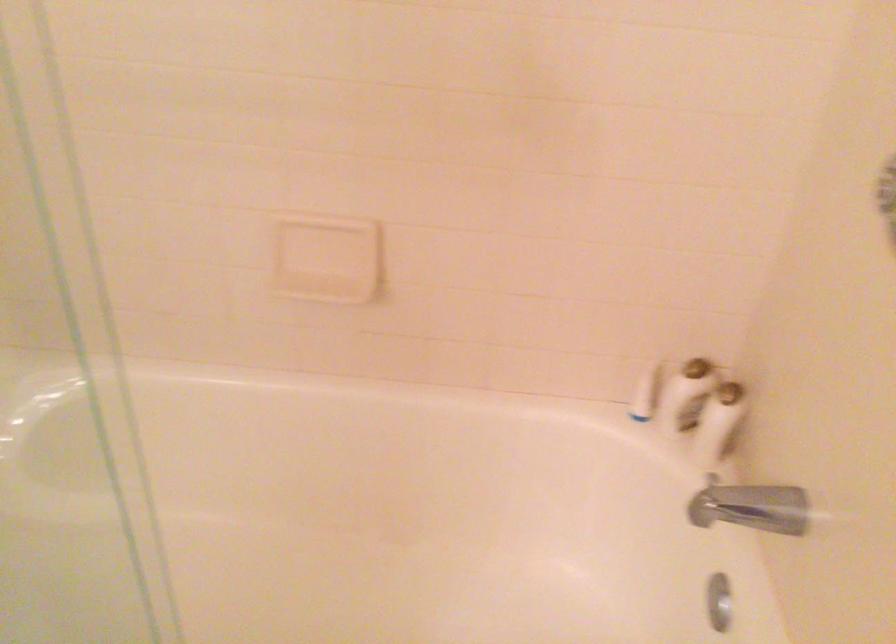
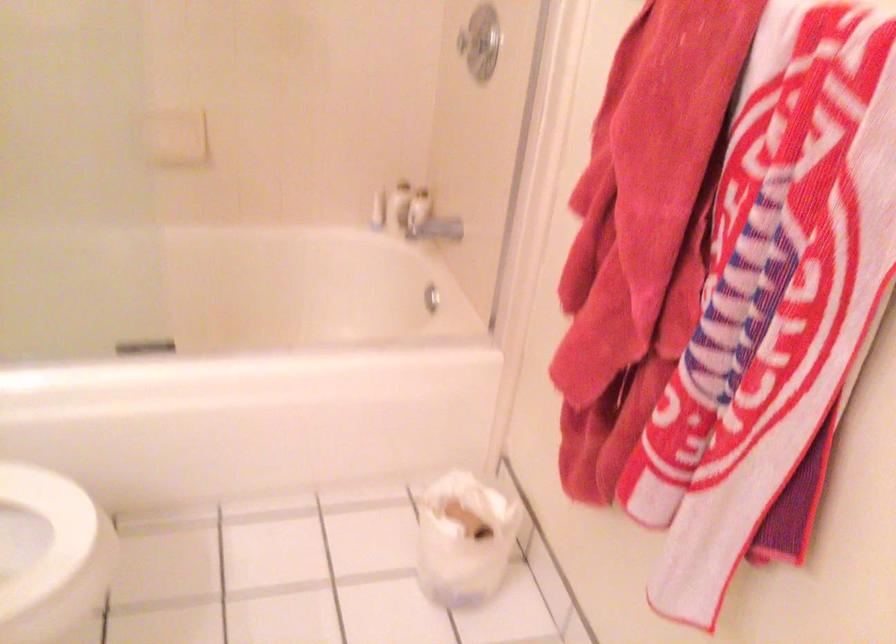
Find the pixel in the second image that matches point (642, 398) in the first image.

(378, 211)